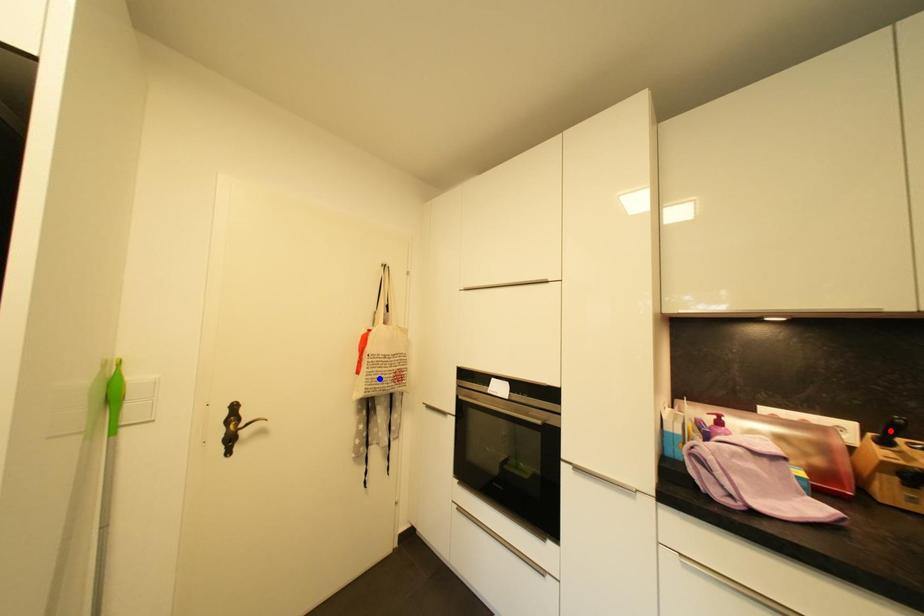
Question: In the image, two points are highlighted. Which point is nearer to the camera? Reply with the corresponding letter.

Choices:
 (A) blue point
 (B) red point

Answer: (B)